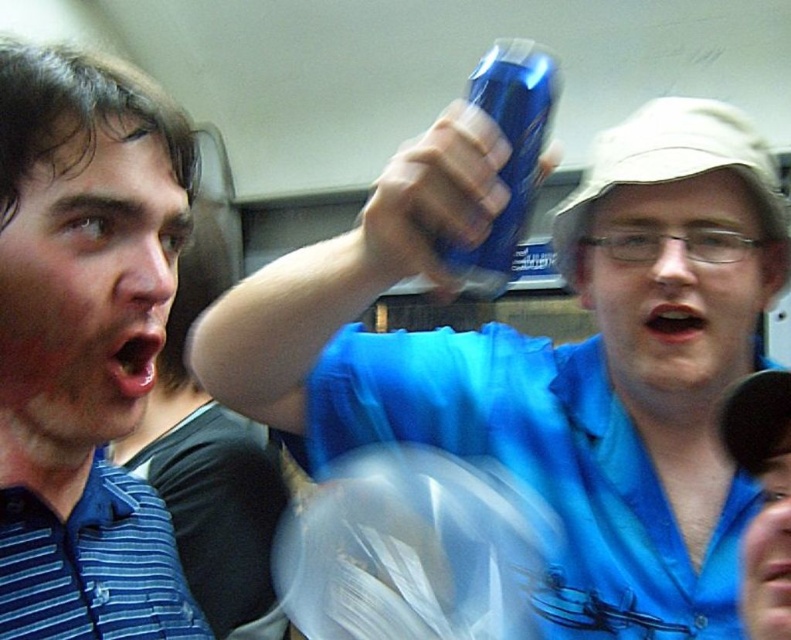
You are a delivery person who needs to place both the blue glossy can at upper center and the blue plastic can at upper center into a box that can only hold items up to the width of the wider can. Which can should you use as the reference for the box size?

The blue glossy can at upper center has a greater width than the blue plastic can at upper center, so you should use the blue glossy can at upper center as the reference for the box size to ensure both cans fit.

Based on the photo, you are a photographer trying to capture both the blue striped polo shirt at left and the blue plastic can at upper center in a single frame. Based on their sizes, which object should you focus on first to ensure both are clearly visible in the photo?

The blue striped polo shirt at left is larger in size than the blue plastic can at upper center, so you should focus on the blue striped polo shirt at left first to ensure both are clearly visible in the photo.